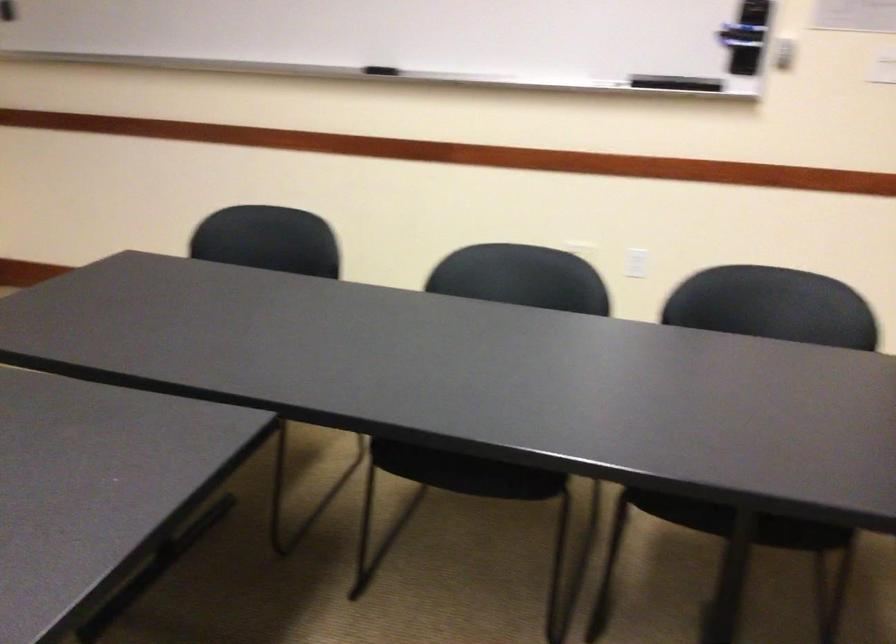
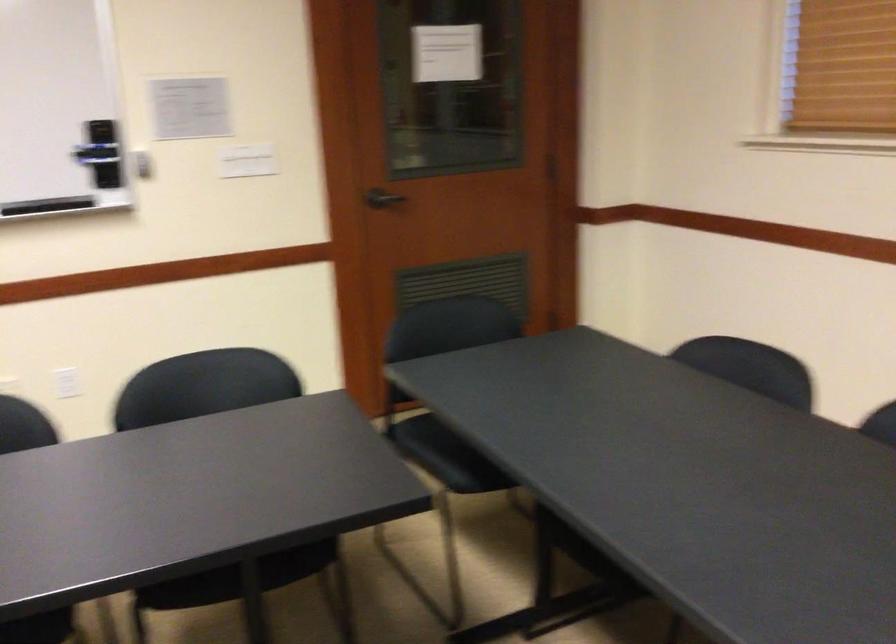
Question: The camera is either moving clockwise (left) or counter-clockwise (right) around the object. The first image is from the beginning of the video and the second image is from the end. Is the camera moving left or right when shooting the video?

Choices:
 (A) Left
 (B) Right

Answer: (A)